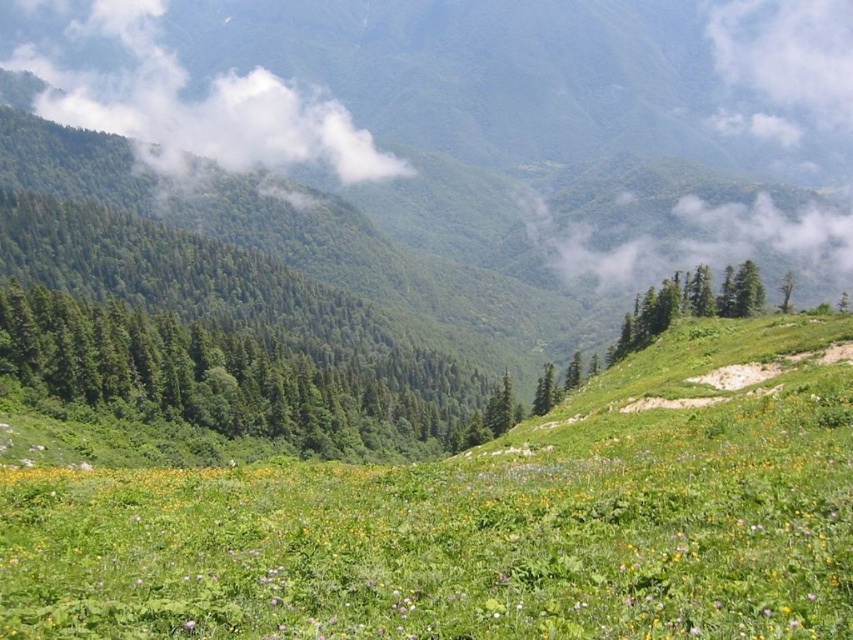
Based on the photo, you are an artist painting this mountain landscape. You want to ensure the white fluffy cloud at upper left and the green leafy tree at upper right are proportionally accurate. Which object should you make larger in your painting?

The white fluffy cloud at upper left should be made larger than the green leafy tree at upper right since it is bigger according to the description.

You are standing in the mountain meadow and looking at the scene. There is a point marked at coordinates (x=199, y=104). What object is located at that point?

The point at (x=199, y=104) marks a white fluffy cloud at upper left.

From the picture: You are an astronomer analyzing the sky in the mountain landscape image. You need to determine the exact coordinates of the white fluffy cloud at upper left. What are its coordinates?

The white fluffy cloud at upper left is located at coordinates point (199,104).